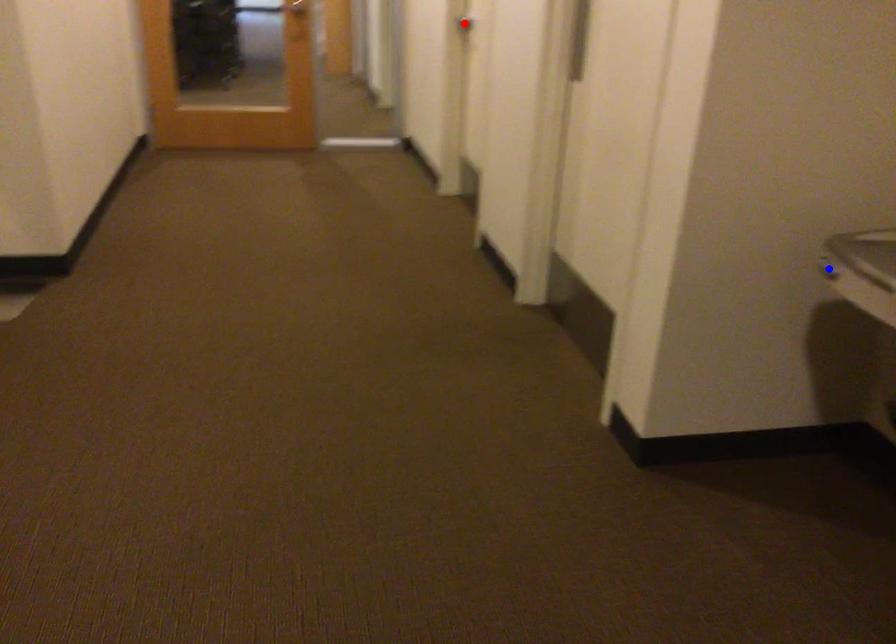
Question: Which of the two points in the image is closer to the camera?

Choices:
 (A) Blue point is closer.
 (B) Red point is closer.

Answer: (A)